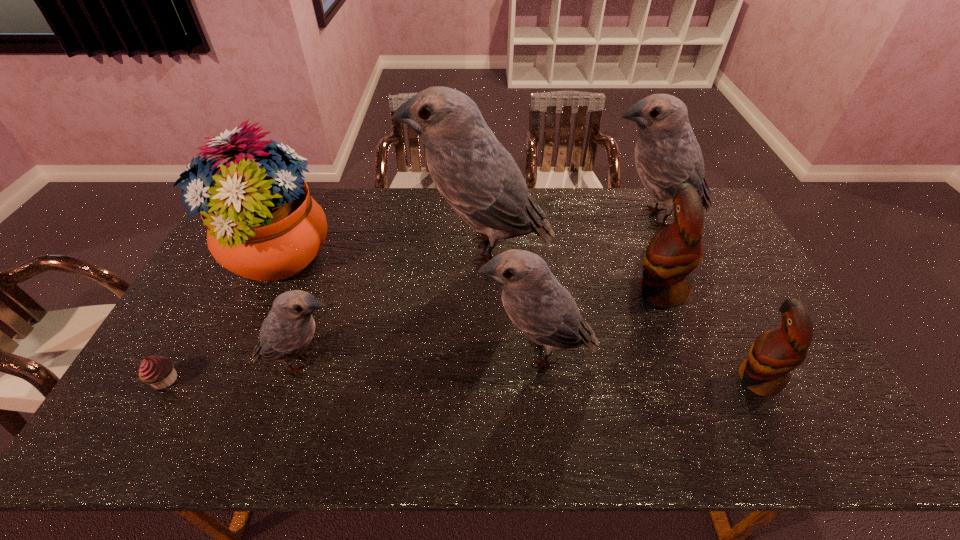
Locate an element on the screen. The width and height of the screenshot is (960, 540). the tallest object is located at coordinates tap(475, 174).

I want to click on the biggest gray parrot, so click(x=475, y=174).

Locate an element on the screen. This screenshot has height=540, width=960. the third smallest gray parrot is located at coordinates (667, 154).

Find the location of a particular element. the fifth shortest parrot is located at coordinates (667, 154).

Find the location of `flower arrangement`. flower arrangement is located at coordinates (263, 225).

The image size is (960, 540). Identify the location of the left red parrot. (673, 253).

Locate an element on the screen. This screenshot has height=540, width=960. the third farthest parrot is located at coordinates (673, 253).

Identify the location of the third biggest gray parrot. (538, 305).

Where is `the leftmost parrot`? This screenshot has height=540, width=960. the leftmost parrot is located at coordinates (289, 327).

At what (x,y) coordinates should I click in order to perform the action: click on the smallest gray parrot. Please return your answer as a coordinate pair (x, y). This screenshot has height=540, width=960. Looking at the image, I should click on (289, 327).